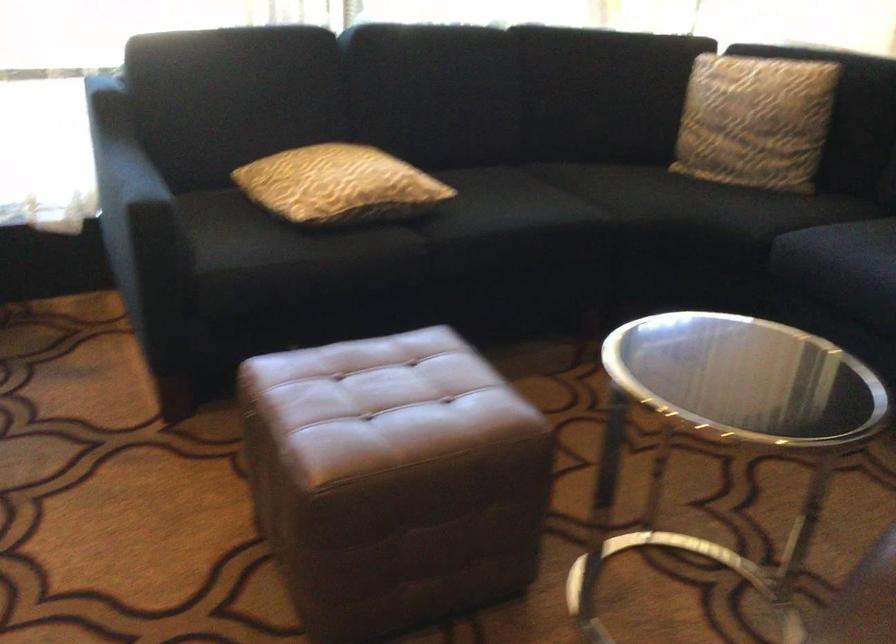
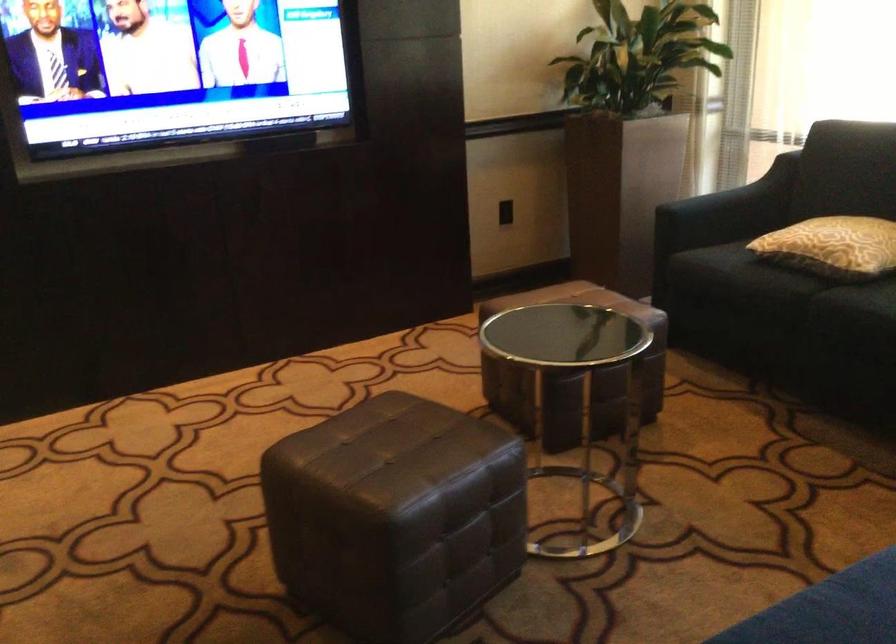
Find the pixel in the second image that matches (x=512, y=456) in the first image.

(573, 373)